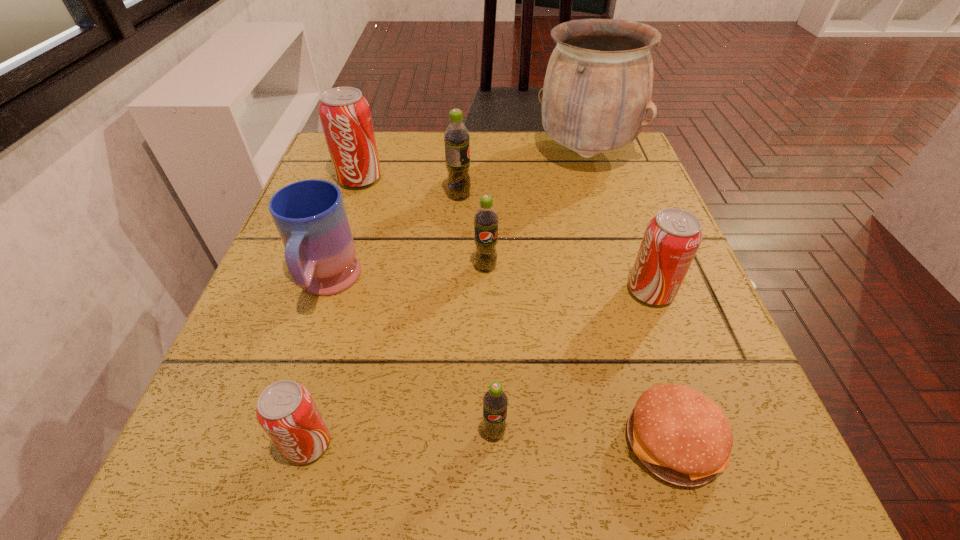
Find the location of a particular element. Image resolution: width=960 pixels, height=540 pixels. free area in between the hamburger and the rightmost soda can is located at coordinates (661, 367).

Image resolution: width=960 pixels, height=540 pixels. What are the coordinates of `unoccupied position between the nearest green soda and the second biggest green soda` in the screenshot? It's located at (490, 349).

This screenshot has height=540, width=960. I want to click on vacant space in between the hamburger and the urn, so click(629, 298).

Find the location of a particular element. This screenshot has width=960, height=540. vacant area between the second smallest green soda and the nearest red soda can is located at coordinates (396, 355).

The height and width of the screenshot is (540, 960). In order to click on unoccupied position between the rightmost soda can and the urn in this screenshot , I will do `click(618, 222)`.

Where is `blank region between the second smallest green soda and the smallest red soda can`? The width and height of the screenshot is (960, 540). blank region between the second smallest green soda and the smallest red soda can is located at coordinates (396, 355).

Identify which object is located as the fourth nearest to the biggest red soda can. Please provide its 2D coordinates. Your answer should be formatted as a tuple, i.e. [(x, y)], where the tuple contains the x and y coordinates of a point satisfying the conditions above.

[(598, 85)]

Locate an element on the screen. The height and width of the screenshot is (540, 960). object that stands as the fifth closest to the second farthest red soda can is located at coordinates (456, 137).

This screenshot has width=960, height=540. I want to click on the closest soda can relative to the smallest red soda can, so click(x=495, y=401).

Select which soda can appears as the closest to the biggest red soda can. Please provide its 2D coordinates. Your answer should be formatted as a tuple, i.e. [(x, y)], where the tuple contains the x and y coordinates of a point satisfying the conditions above.

[(456, 137)]